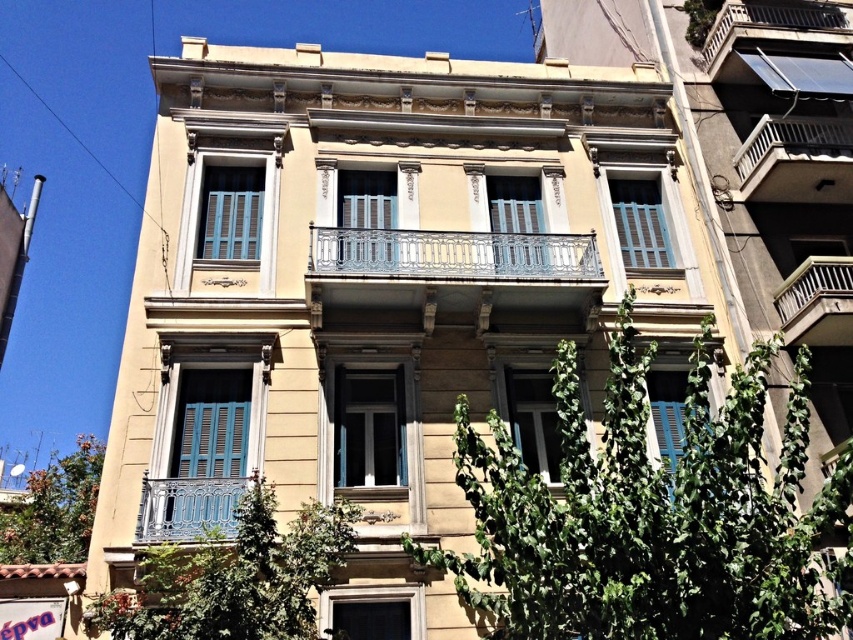
Consider the image. Is metallic wrought iron balcony at right smaller than metallic silver balcony at upper right?

Yes, metallic wrought iron balcony at right is smaller than metallic silver balcony at upper right.

This screenshot has height=640, width=853. Identify the location of metallic wrought iron balcony at right. (817, 301).

The image size is (853, 640). I want to click on metallic wrought iron balcony at right, so click(817, 301).

I want to click on metallic wrought iron balcony at right, so click(x=817, y=301).

Between metallic wrought iron balcony at center and metallic wrought iron balcony at upper right, which one is positioned lower?

Positioned lower is metallic wrought iron balcony at center.

Is point (440, 253) closer to camera compared to point (770, 161)?

Yes, it is.

Between point (498, 250) and point (844, 154), which one is positioned behind?

Point (844, 154)

Find the location of a particular element. The width and height of the screenshot is (853, 640). metallic wrought iron balcony at center is located at coordinates (453, 253).

Does metallic wrought iron balcony at upper right appear on the left side of metallic wrought iron balcony at right?

Incorrect, metallic wrought iron balcony at upper right is not on the left side of metallic wrought iron balcony at right.

Does metallic wrought iron balcony at upper right appear on the right side of metallic wrought iron balcony at right?

Indeed, metallic wrought iron balcony at upper right is positioned on the right side of metallic wrought iron balcony at right.

Where is `metallic wrought iron balcony at upper right`? The height and width of the screenshot is (640, 853). metallic wrought iron balcony at upper right is located at coordinates (796, 161).